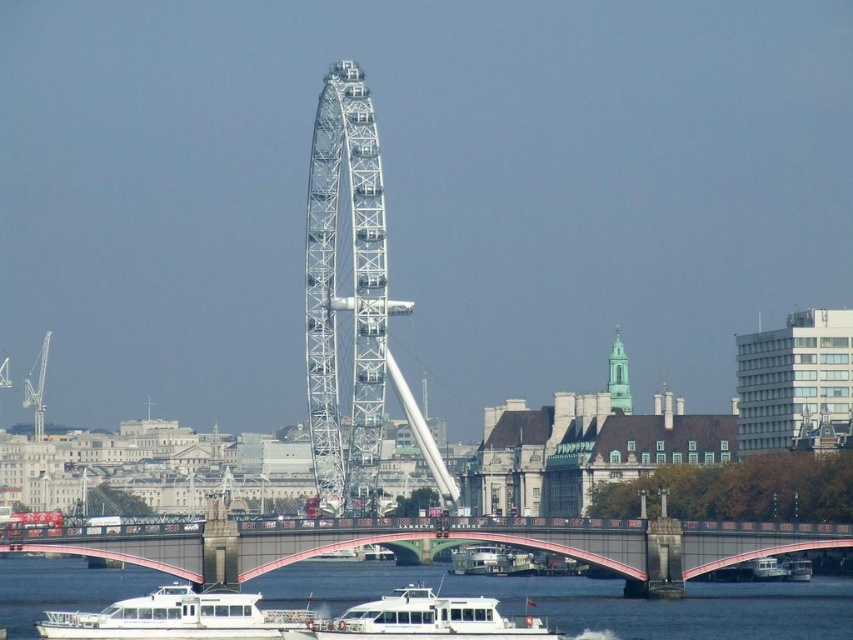
Who is taller, white matte boat at center or white glossy boat at lower center?

With more height is white matte boat at center.

Can you confirm if white matte boat at center is taller than white glossy boat at lower center?

Correct, white matte boat at center is much taller as white glossy boat at lower center.

This screenshot has width=853, height=640. Find the location of `white matte boat at center`. white matte boat at center is located at coordinates (430, 618).

I want to click on white matte boat at center, so click(x=430, y=618).

Find the location of a particular element. white metallic ferris wheel at center is located at coordinates (345, 296).

Looking at this image, between white metallic ferris wheel at center and white glossy boat at center, which one appears on the left side from the viewer's perspective?

white metallic ferris wheel at center is more to the left.

Where is `white metallic ferris wheel at center`? This screenshot has height=640, width=853. white metallic ferris wheel at center is located at coordinates (345, 296).

Locate an element on the screen. Image resolution: width=853 pixels, height=640 pixels. white metallic ferris wheel at center is located at coordinates (345, 296).

Is metallic pink bridge at center wider than white matte boat at lower center?

Indeed, metallic pink bridge at center has a greater width compared to white matte boat at lower center.

Who is shorter, metallic pink bridge at center or white matte boat at lower center?

Standing shorter between the two is white matte boat at lower center.

Which is in front, point (186, 576) or point (160, 628)?

Positioned in front is point (160, 628).

Where is `metallic pink bridge at center`? metallic pink bridge at center is located at coordinates (434, 538).